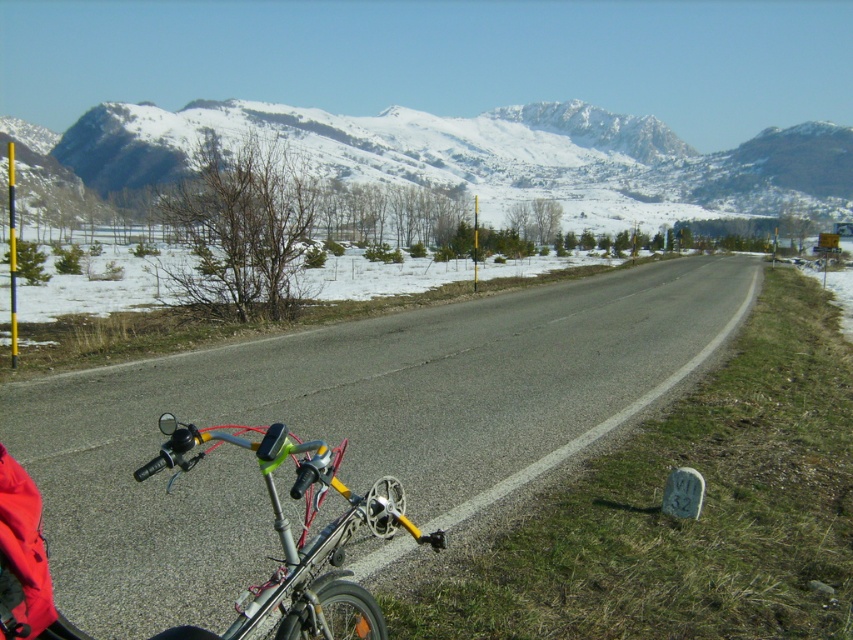
Question: Can you confirm if snowy rocky mountain at upper center is positioned to the right of silver metallic bicycle handlebars at lower left?

Choices:
 (A) yes
 (B) no

Answer: (B)

Question: Does snowy rocky mountain at upper center appear on the right side of silver metallic bicycle handlebars at lower left?

Choices:
 (A) no
 (B) yes

Answer: (A)

Question: Can you confirm if snowy rocky mountain at upper center is wider than silver metallic bicycle handlebars at lower left?

Choices:
 (A) no
 (B) yes

Answer: (B)

Question: Among these points, which one is farthest from the camera?

Choices:
 (A) (165, 456)
 (B) (540, 177)

Answer: (B)